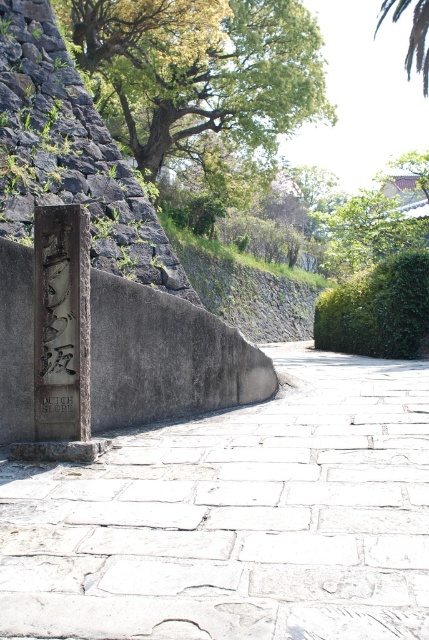
You are a tourist visiting the historical site and want to walk from the stone plaque at center to the white stone pavement at center. Which direction should you move to reach the lower area?

The white stone pavement at center has a lesser height compared to the stone plaque at center, so you should move downward towards the white stone pavement at center to reach the lower area.

You are standing at the stone pathway in the scene and want to take a photo of the green leafy tree at upper left. If your camera can focus up to 20 meters away, will you be able to capture a clear photo of the tree?

The distance between you and the green leafy tree at upper left is 18.43 meters, which is within the camera focus range of 20 meters. Therefore, you can capture a clear photo of the tree.